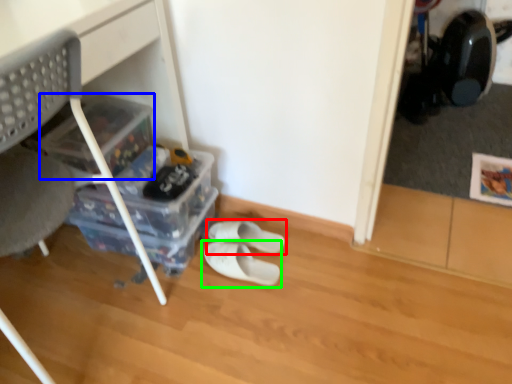
Question: Which object is positioned closest to footwear (highlighted by a red box)? Select from storage box (highlighted by a blue box) and footwear (highlighted by a green box).

Choices:
 (A) storage box
 (B) footwear

Answer: (B)